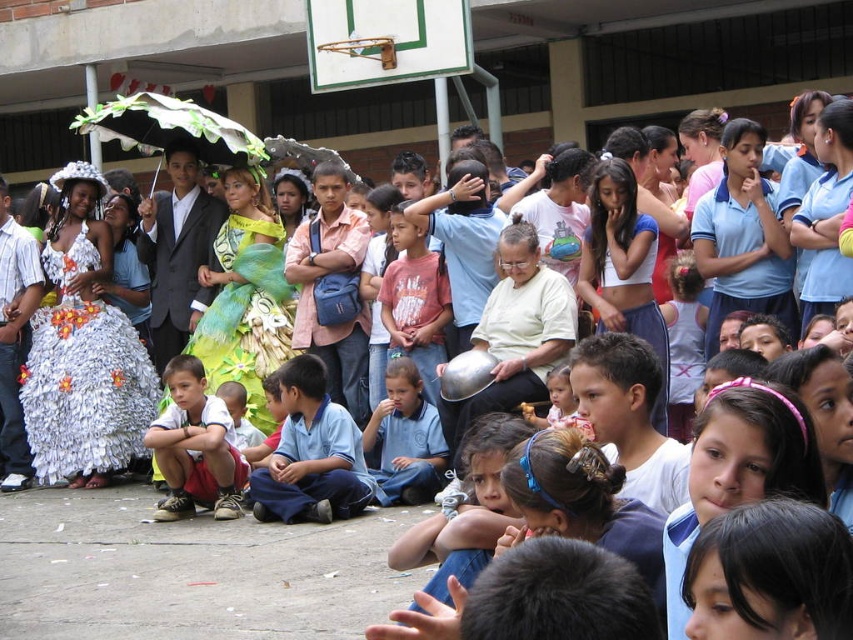
Which is more to the right, white fluffy dress at left or light blue uniform at center?

light blue uniform at center

Which is below, white fluffy dress at left or light blue uniform at center?

Positioned lower is light blue uniform at center.

You are a GUI agent. You are given a task and a screenshot of the screen. Output one action in this format:
    pyautogui.click(x=<x>, y=<y>)
    Task: Click on the white fluffy dress at left
    
    Given the screenshot: What is the action you would take?
    pyautogui.click(x=83, y=376)

In order to click on white fluffy dress at left in this screenshot , I will do `click(83, 376)`.

Which is more to the left, white fluffy dress at left or red cotton shirt at center?

From the viewer's perspective, white fluffy dress at left appears more on the left side.

Is white fluffy dress at left further to the viewer compared to red cotton shirt at center?

That is False.

What do you see at coordinates (83, 376) in the screenshot? I see `white fluffy dress at left` at bounding box center [83, 376].

The image size is (853, 640). In order to click on white fluffy dress at left in this screenshot , I will do `click(83, 376)`.

I want to click on green leafy umbrella at center, so click(173, 129).

Between point (196, 108) and point (370, 444), which one is positioned behind?

The point (196, 108) is more distant.

Is point (196, 129) positioned before point (418, 476)?

No, it is behind (418, 476).

Locate an element on the screen. This screenshot has width=853, height=640. green leafy umbrella at center is located at coordinates (173, 129).